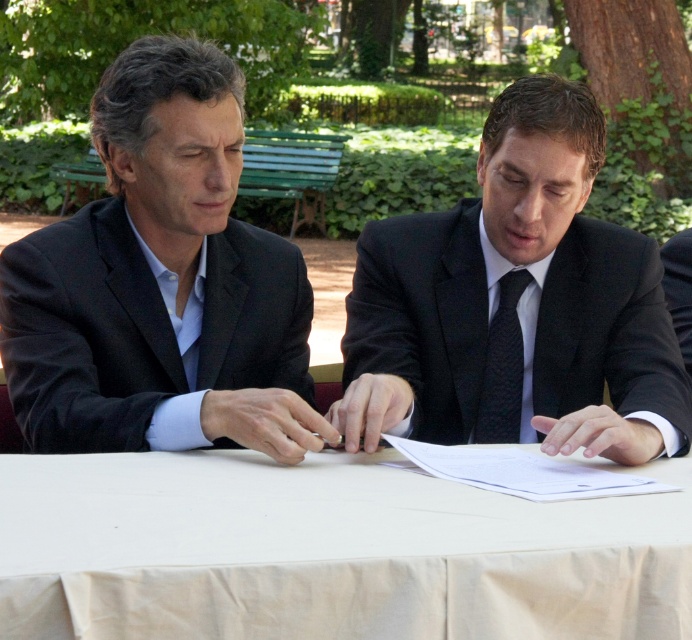
Who is positioned more to the right, black matte suit at left or black silk suit at lower right?

Positioned to the right is black silk suit at lower right.

Who is more distant from viewer, (194,38) or (671,268)?

The point (194,38) is more distant.

Image resolution: width=692 pixels, height=640 pixels. I want to click on black matte suit at left, so click(161, 284).

Which is below, black matte suit at left or black matte suit at center?

Positioned lower is black matte suit at center.

From the picture: Does black matte suit at left have a greater height compared to black matte suit at center?

Yes, black matte suit at left is taller than black matte suit at center.

Which is in front, point (145, 440) or point (392, 296)?

Point (145, 440)

You are a GUI agent. You are given a task and a screenshot of the screen. Output one action in this format:
    pyautogui.click(x=<x>, y=<y>)
    Task: Click on the black matte suit at left
    
    Given the screenshot: What is the action you would take?
    pyautogui.click(x=161, y=284)

Locate an element on the screen. white cloth at center is located at coordinates (329, 552).

Is white cloth at center to the left of black silk suit at lower right from the viewer's perspective?

Indeed, white cloth at center is positioned on the left side of black silk suit at lower right.

Does point (131, 632) come farther from viewer compared to point (682, 289)?

No, (131, 632) is in front of (682, 289).

Image resolution: width=692 pixels, height=640 pixels. What are the coordinates of `white cloth at center` in the screenshot? It's located at (329, 552).